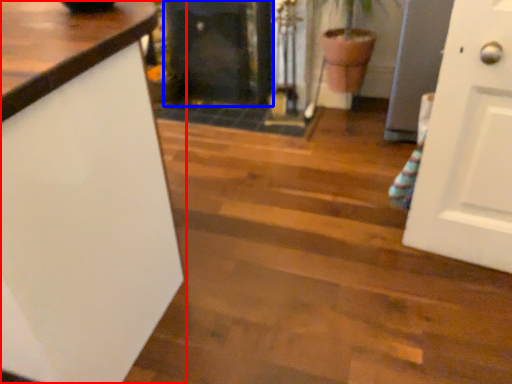
Question: Which object is further to the camera taking this photo, countertop (highlighted by a red box) or fireplace (highlighted by a blue box)?

Choices:
 (A) countertop
 (B) fireplace

Answer: (B)